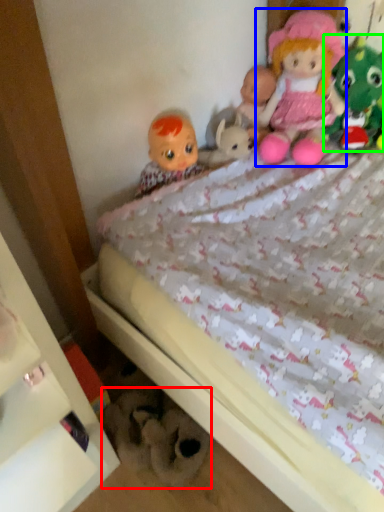
Question: Which object is the closest to the toy (highlighted by a red box)? Choose among these: doll (highlighted by a blue box) or toy (highlighted by a green box).

Choices:
 (A) doll
 (B) toy

Answer: (A)